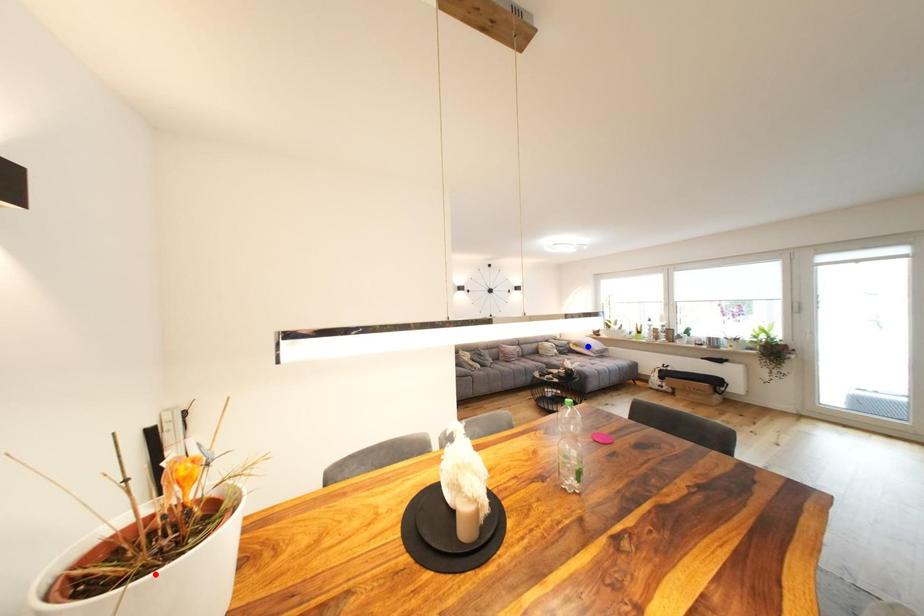
Question: Which of the two points in the image is closer to the camera?

Choices:
 (A) Blue point is closer.
 (B) Red point is closer.

Answer: (B)